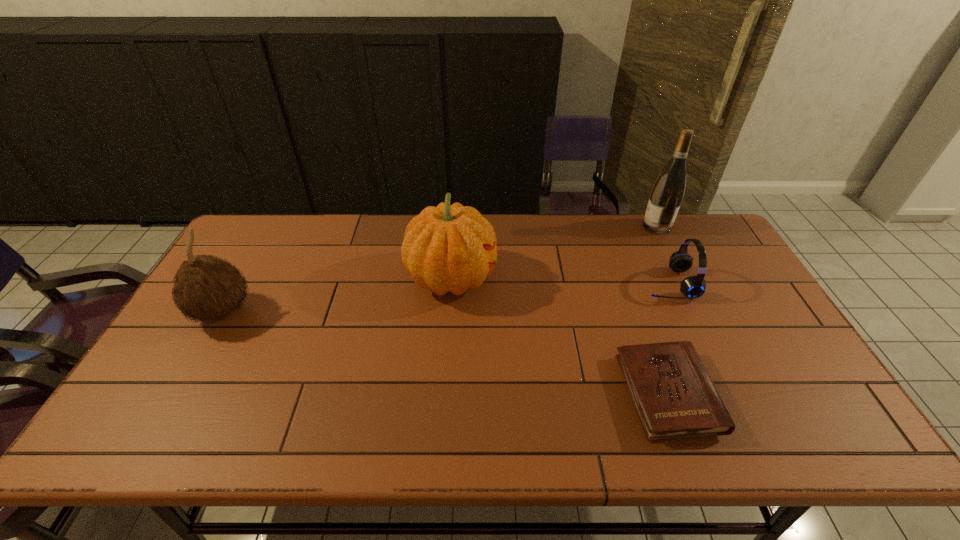
Where is `the farthest object`? Image resolution: width=960 pixels, height=540 pixels. the farthest object is located at coordinates (667, 194).

The width and height of the screenshot is (960, 540). Find the location of `wine bottle`. wine bottle is located at coordinates (667, 194).

Find the location of a particular element. This screenshot has width=960, height=540. the fourth object from right to left is located at coordinates (446, 248).

The height and width of the screenshot is (540, 960). Find the location of `the leftmost object`. the leftmost object is located at coordinates 207,288.

Identify the location of the fourth tallest object. This screenshot has width=960, height=540. (692, 287).

Identify the location of the nearest object. (674, 396).

At what (x,y) coordinates should I click in order to perform the action: click on hardback book. Please return your answer as a coordinate pair (x, y). Looking at the image, I should click on (674, 396).

Find the location of `vacant space located 0.080m on the label of the tallest object`. vacant space located 0.080m on the label of the tallest object is located at coordinates (620, 226).

The width and height of the screenshot is (960, 540). What are the coordinates of `vacant area situated 0.370m on the label of the tallest object` in the screenshot? It's located at (539, 226).

Where is `vacant region located 0.180m on the label of the tallest object`? The image size is (960, 540). vacant region located 0.180m on the label of the tallest object is located at coordinates (592, 226).